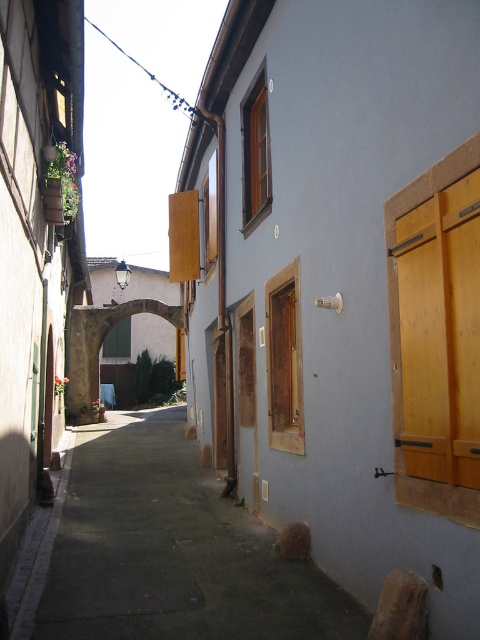
You are a delivery person with a cart that is 1.2 meters wide. You are in the alleyway and need to pass through the narrowest point between the smooth concrete sidewalk at center and the yellow wood shutters at right. Can your cart fit through?

The smooth concrete sidewalk at center might be wider than yellow wood shutters at right, so it is possible that the narrowest point is at the yellow wood shutters at right. However, since the exact width isn not provided, we cannot confirm if the cart will fit. Please check the actual width before proceeding.

From the picture: You are a delivery person carrying a heavy box and need to place it on the ground in the alley. The yellow wood shutters at right are in your way. Can you move the box to the smooth concrete sidewalk at center without touching the shutters?

The smooth concrete sidewalk at center is below the yellow wood shutters at right, so you can safely move the box to the sidewalk without touching the shutters.

You are a delivery person standing on the smooth concrete sidewalk at center and need to deliver a package to the yellow wood shutters at right. Can you reach the shutters without climbing anything?

The smooth concrete sidewalk at center is not as tall as the yellow wood shutters at right, so you would need to climb or use a ladder to reach the yellow wood shutters at right since they are taller than the sidewalk.